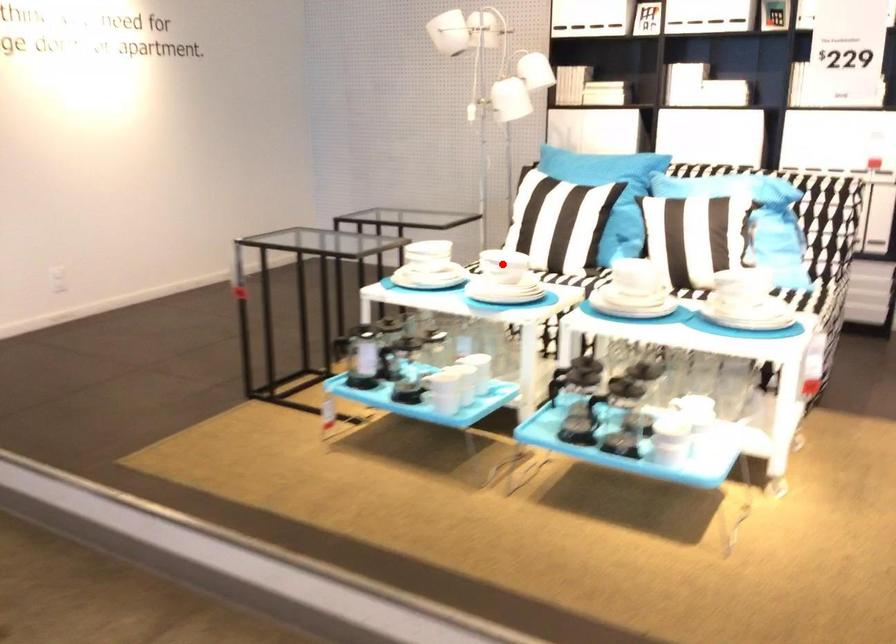
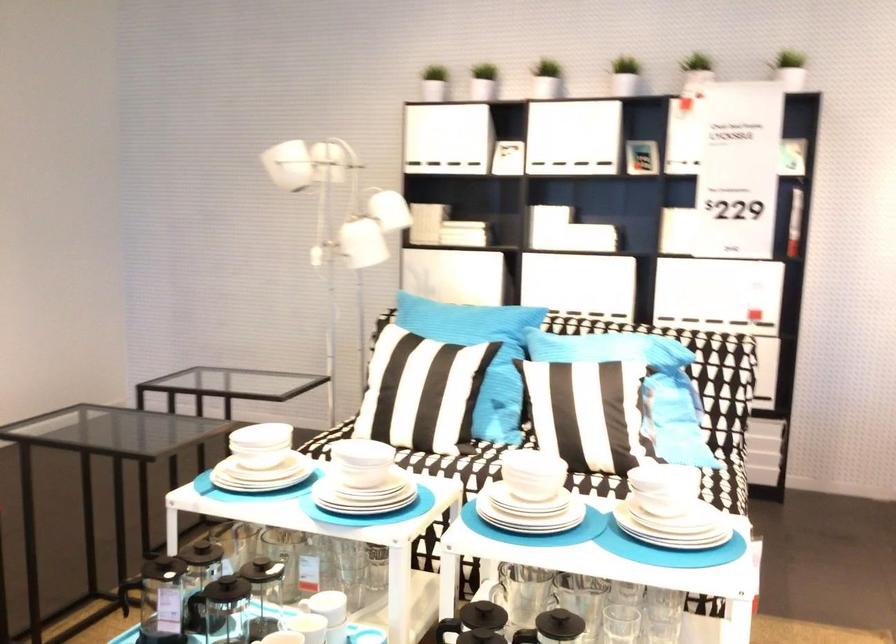
Where in the second image is the point corresponding to the highlighted location from the first image?

(360, 464)